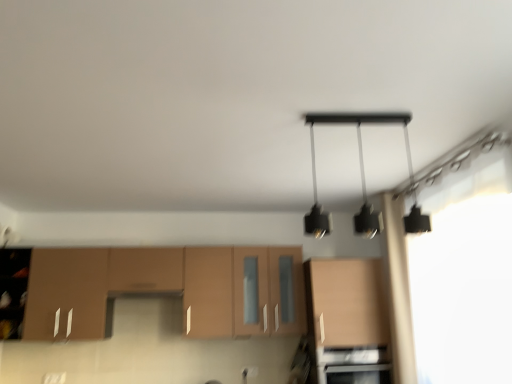
Question: In terms of height, does black stainless steel oven at lower center look taller or shorter compared to transparent fabric at upper right?

Choices:
 (A) tall
 (B) short

Answer: (B)

Question: From a real-world perspective, is black stainless steel oven at lower center physically located above or below transparent fabric at upper right?

Choices:
 (A) above
 (B) below

Answer: (B)

Question: Which is farther from the matte wood cabinet at center, the 1th cabinetry when ordered from right to left?

Choices:
 (A) black matte pendant light at upper center
 (B) matte wood cabinetry at lower left, arranged as the 2th cabinetry when viewed from the right
 (C) black stainless steel oven at lower center
 (D) transparent fabric at upper right

Answer: (A)

Question: Which object is positioned farthest from the black stainless steel oven at lower center?

Choices:
 (A) matte wood cabinet at center, the 2th cabinetry from the left
 (B) matte wood cabinetry at lower left, arranged as the 2th cabinetry when viewed from the right
 (C) transparent fabric at upper right
 (D) black matte pendant light at upper center

Answer: (D)